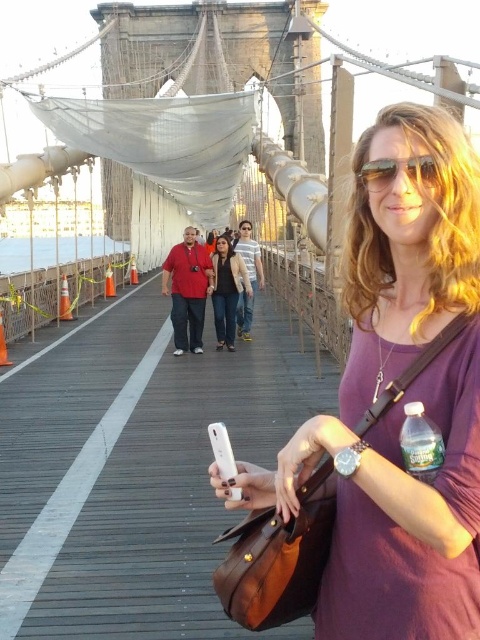
You are a fashion stylist analyzing the outfit of the woman on the Brooklyn Bridge. She is wearing a purple long sleeve top and has a matte black jacket at center and sunglasses at center. Which item is positioned lower on her body?

The matte black jacket at center is below sunglasses at center, so the matte black jacket at center is positioned lower on her body.

You are standing on the Brooklyn Bridge and see two points marked in the image. Which point is closer to you, point (219, 328) or point (410, 163)?

Point (219, 328) is further to the camera than point (410, 163), so point (410, 163) is closer to you.

You are a photographer standing on the Brooklyn Bridge and want to take a photo of the clear plastic bottle at lower right. The camera you are using has a maximum focus range of 160 feet. Can you capture the bottle clearly with this camera?

The clear plastic bottle at lower right and camera are 162.35 feet apart from each other. Since the distance exceeds the camera maximum focus range of 160 feet, the camera cannot capture the bottle clearly.